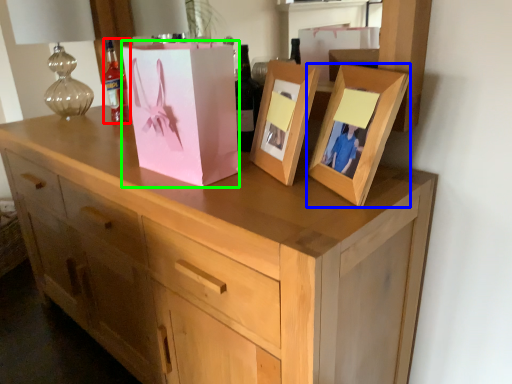
Question: Based on their relative distances, which object is farther from bottle (highlighted by a red box)? Choose from picture frame (highlighted by a blue box) and cardboard box (highlighted by a green box).

Choices:
 (A) picture frame
 (B) cardboard box

Answer: (A)